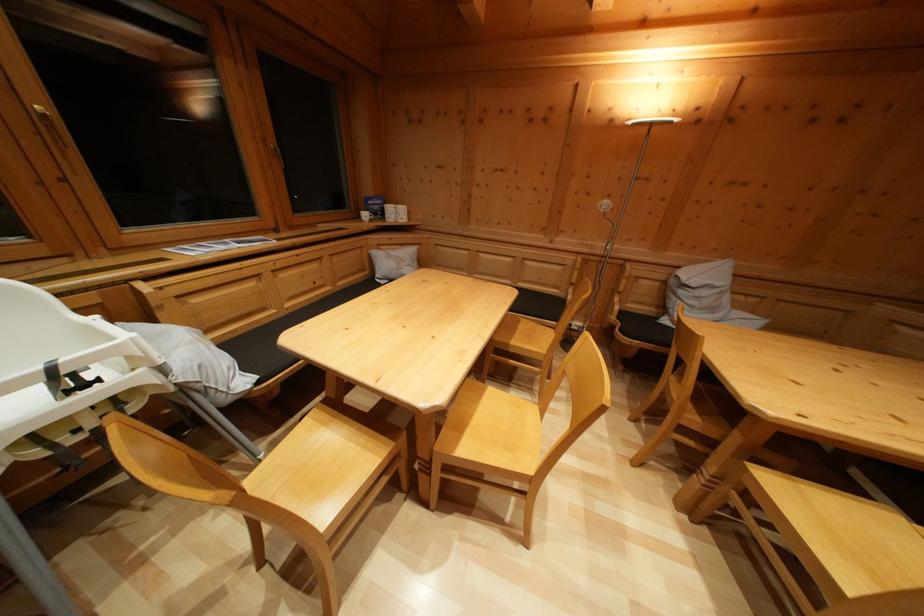
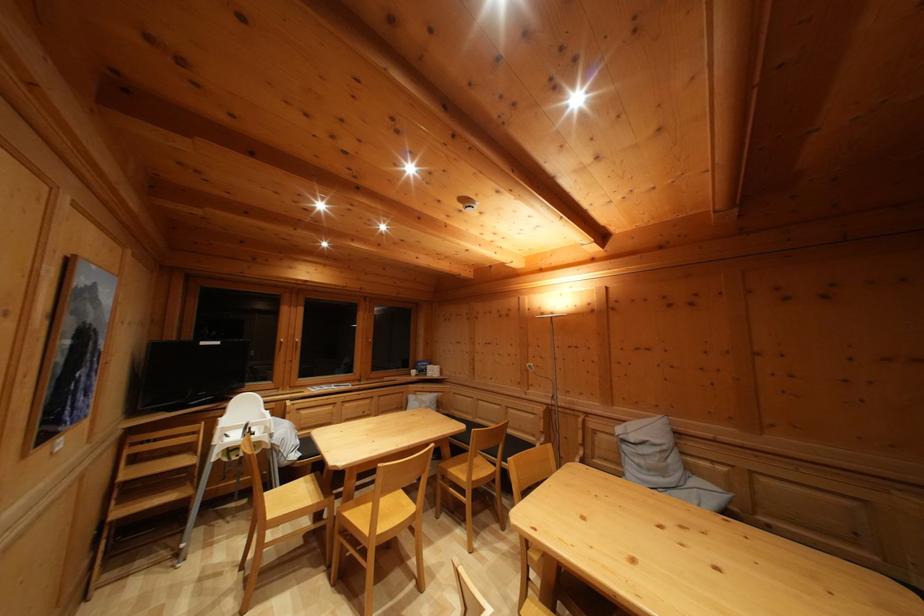
Where in the second image is the point corresponding to [371,222] from the first image?

(419, 379)